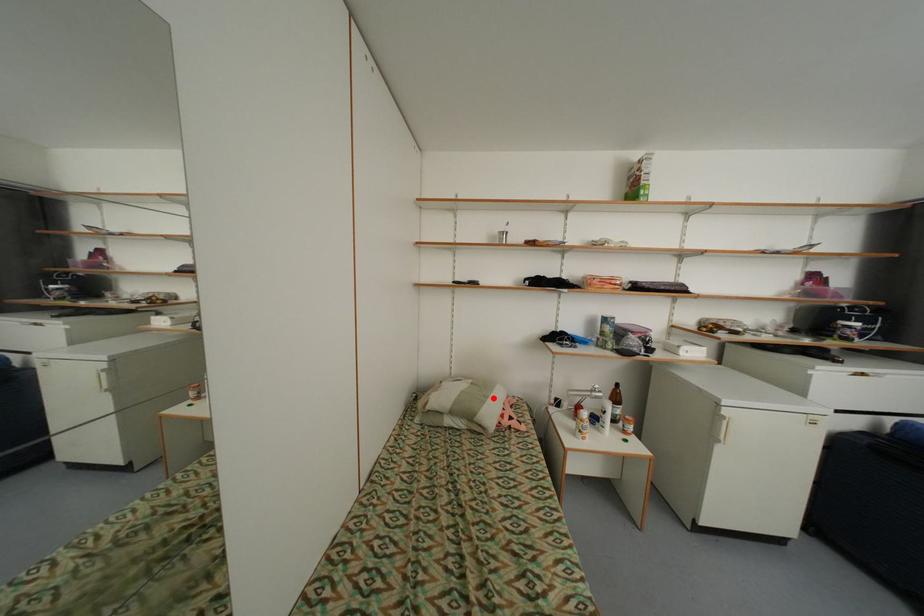
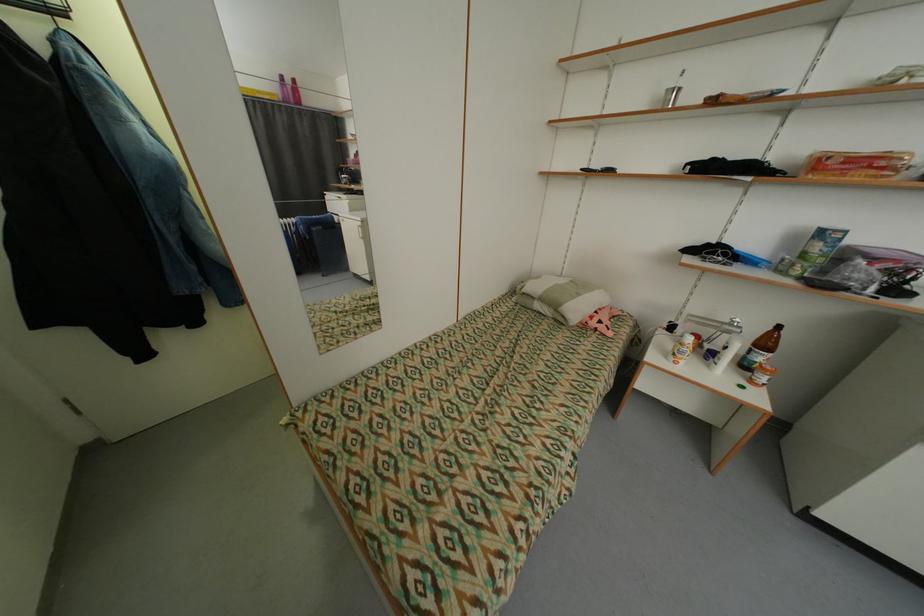
Find the pixel in the second image that matches the highlighted location in the first image.

(585, 296)